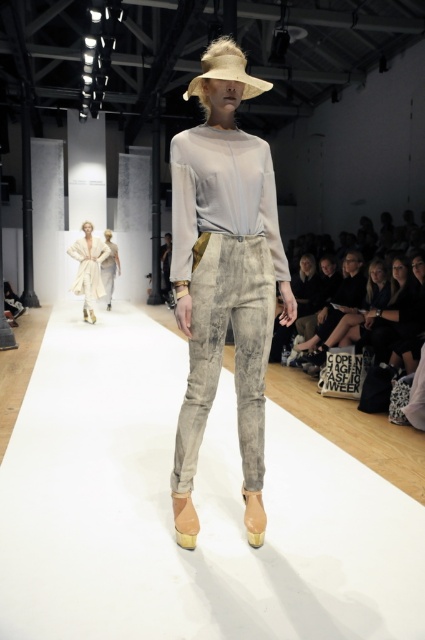
Who is positioned more to the left, distressed linen pants at center or matte white coat at center?

matte white coat at center is more to the left.

Who is higher up, distressed linen pants at center or matte white coat at center?

matte white coat at center is above.

Is point (263, 248) less distant than point (78, 272)?

That is True.

Where is `distressed linen pants at center`? The height and width of the screenshot is (640, 425). distressed linen pants at center is located at coordinates (224, 275).

Consider the image. Is matte white coat at center wider than light beige textured pants at center?

Correct, the width of matte white coat at center exceeds that of light beige textured pants at center.

Based on the photo, does matte white coat at center appear over light beige textured pants at center?

Actually, matte white coat at center is below light beige textured pants at center.

Does point (108, 252) come in front of point (113, 285)?

Yes, point (108, 252) is closer to viewer.

Locate an element on the screen. This screenshot has height=640, width=425. matte white coat at center is located at coordinates click(x=88, y=268).

What are the coordinates of `beige straw hat at center` in the screenshot? It's located at (224, 70).

Can you confirm if beige straw hat at center is shorter than light beige textured pants at center?

Yes.

Is point (217, 74) positioned after point (112, 262)?

No, it is in front of (112, 262).

This screenshot has height=640, width=425. I want to click on beige straw hat at center, so click(224, 70).